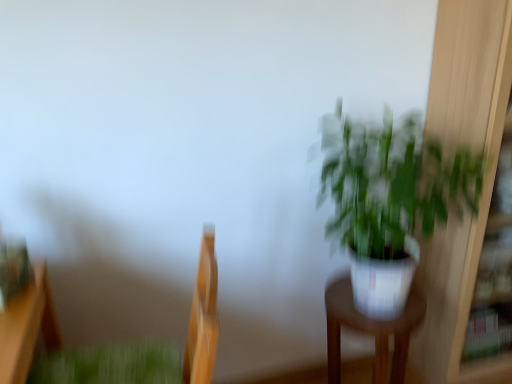
Question: Does white glossy pot at center-right have a lesser width compared to green matte plant at lower left?

Choices:
 (A) no
 (B) yes

Answer: (B)

Question: From the image's perspective, is white glossy pot at center-right on green matte plant at lower left?

Choices:
 (A) no
 (B) yes

Answer: (A)

Question: Is the position of white glossy pot at center-right more distant than that of green matte plant at lower left?

Choices:
 (A) yes
 (B) no

Answer: (A)

Question: Is white glossy pot at center-right positioned far away from green matte plant at lower left?

Choices:
 (A) no
 (B) yes

Answer: (A)

Question: Does white glossy pot at center-right touch green matte plant at lower left?

Choices:
 (A) no
 (B) yes

Answer: (A)

Question: From a real-world perspective, is white glossy pot at center-right over green matte plant at lower left?

Choices:
 (A) yes
 (B) no

Answer: (B)

Question: Can you confirm if white glossy pot at right is smaller than wooden swivel chair at left?

Choices:
 (A) yes
 (B) no

Answer: (B)

Question: Considering the relative positions of white glossy pot at right and wooden swivel chair at left in the image provided, is white glossy pot at right to the right of wooden swivel chair at left from the viewer's perspective?

Choices:
 (A) no
 (B) yes

Answer: (B)

Question: Is white glossy pot at right not near wooden swivel chair at left?

Choices:
 (A) yes
 (B) no

Answer: (B)

Question: Considering the relative sizes of white glossy pot at right and wooden swivel chair at left in the image provided, is white glossy pot at right shorter than wooden swivel chair at left?

Choices:
 (A) no
 (B) yes

Answer: (A)

Question: From the image's perspective, would you say white glossy pot at right is shown under wooden swivel chair at left?

Choices:
 (A) yes
 (B) no

Answer: (B)

Question: Is white glossy pot at right wider than wooden swivel chair at left?

Choices:
 (A) yes
 (B) no

Answer: (B)

Question: Is white glossy pot at right located within white glossy pot at center-right?

Choices:
 (A) no
 (B) yes

Answer: (A)